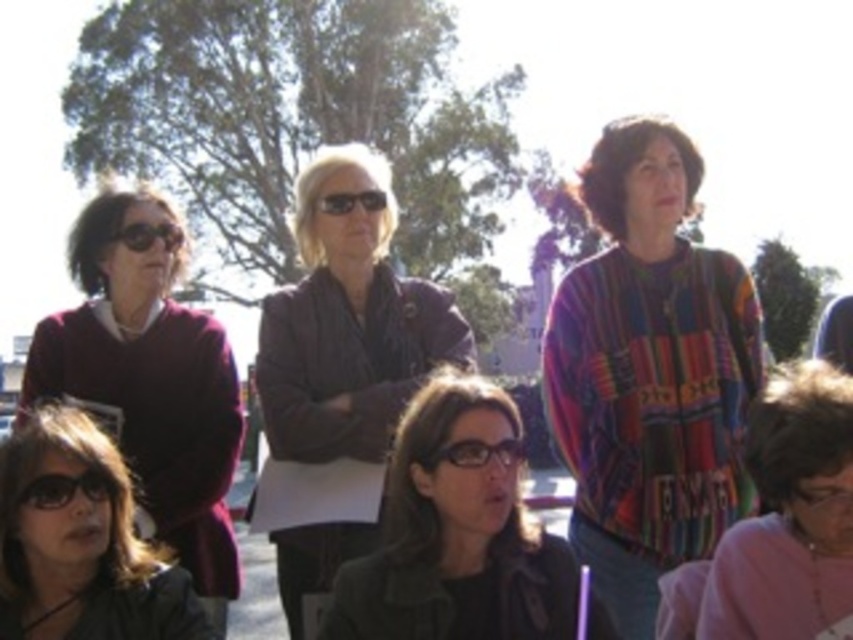
Does black plastic glasses at lower left appear on the right side of shiny black sunglasses at center?

No, black plastic glasses at lower left is not to the right of shiny black sunglasses at center.

Who is higher up, black plastic glasses at lower left or shiny black sunglasses at center?

Positioned higher is shiny black sunglasses at center.

Does point (108, 490) lie behind point (345, 200)?

That is False.

The image size is (853, 640). Identify the location of black plastic glasses at lower left. (64, 490).

Does point (136, 248) come farther from viewer compared to point (344, 193)?

No, it is in front of (344, 193).

Which is behind, point (144, 237) or point (386, 200)?

The point (386, 200) is behind.

At what (x,y) coordinates should I click in order to perform the action: click on black plastic goggles at upper left. Please return your answer as a coordinate pair (x, y). Looking at the image, I should click on pyautogui.click(x=149, y=236).

Is pink fabric at lower right behind clear plastic glasses at center?

No, it is not.

Does point (840, 380) come closer to viewer compared to point (456, 460)?

Yes.

Image resolution: width=853 pixels, height=640 pixels. Find the location of `pink fabric at lower right`. pink fabric at lower right is located at coordinates (791, 516).